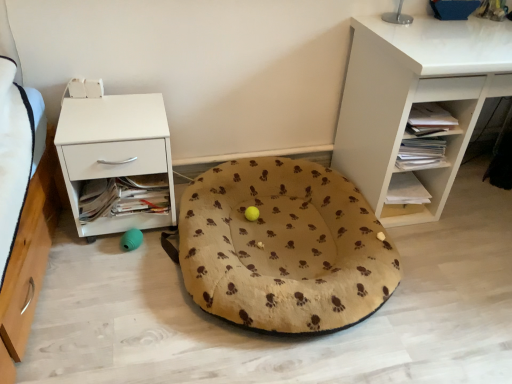
The image size is (512, 384). I want to click on vacant space in front of white matte nightstand at left, so click(109, 279).